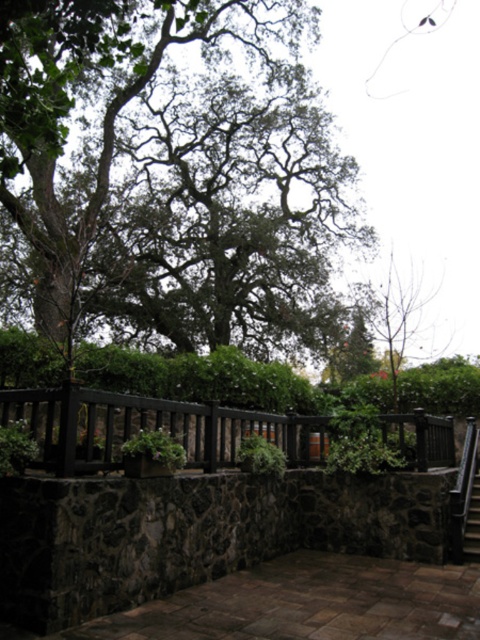
You are a delivery person carrying a package that requires a clear path of at least 7 meters to maneuver safely. You see the black wood fence at center and the metallic staircase at center. Is there enough space between them to move through safely?

The distance between the black wood fence at center and the metallic staircase at center is 7.38 meters, which is more than the required 7 meters. Therefore, there is enough space to move through safely.

You are standing in the garden and want to take a photo of the green leafy tree at upper center without the black wood fence at center blocking the view. Is this possible based on their positions?

Yes, the green leafy tree at upper center is in front of the black wood fence at center, so you can take a photo of the green leafy tree at upper center without the black wood fence at center blocking the view.

You are standing at the bottom of the stairs in the courtyard. You want to take a photo of the metallic staircase at center while also including the green leafy tree at upper center in the frame. Is the tree positioned above the staircase so that you can capture both in a single shot?

Yes, the green leafy tree at upper center is located above the metallic staircase at center, so you can capture both in a single photo by angling the camera upwards.